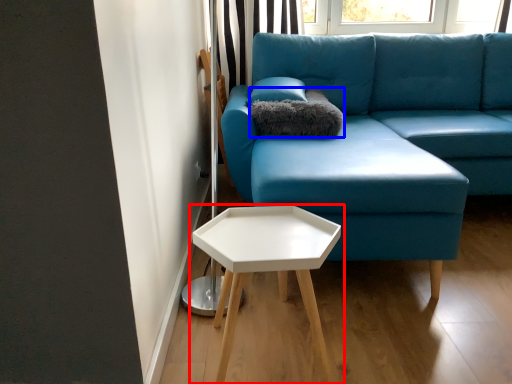
Question: Among these objects, which one is farthest to the camera, table (highlighted by a red box) or pillow (highlighted by a blue box)?

Choices:
 (A) table
 (B) pillow

Answer: (B)